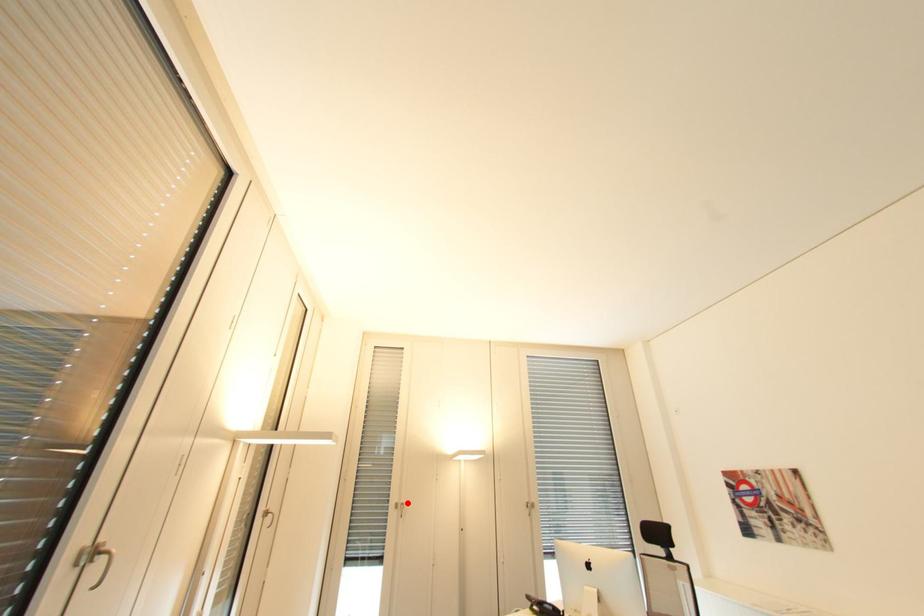
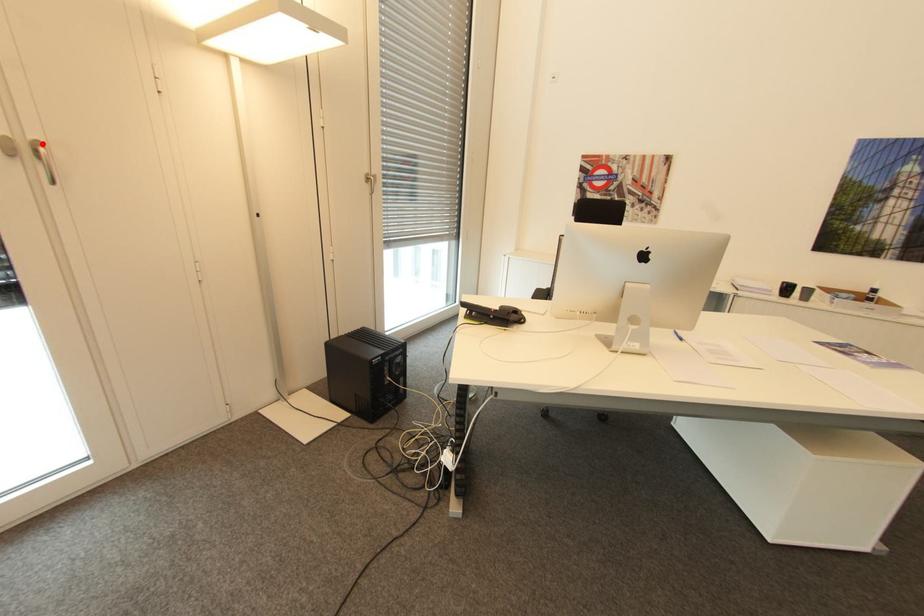
I am providing you with two images of the same scene from different viewpoints. A red point is marked on the first image and another point is marked on the second image. Do the highlighted points in image1 and image2 indicate the same real-world spot?

Yes